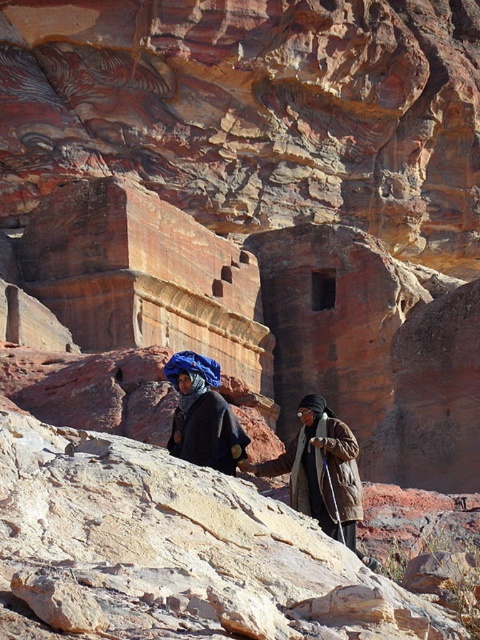
You are a photographer trying to capture the two travelers in the scene. If you want to frame the dark blue woolen robe at center so it appears to the left of the brown textured coat at center in your photo, which direction should you move your camera?

You should move your camera to the right so that the dark blue woolen robe at center appears to the left of the brown textured coat at center.

You are a hiker trying to cross the rocky path. You see the smooth beige rock at center and the dark blue woolen robe at center. Which object is wider?

The smooth beige rock at center might be wider than dark blue woolen robe at center according to the description.